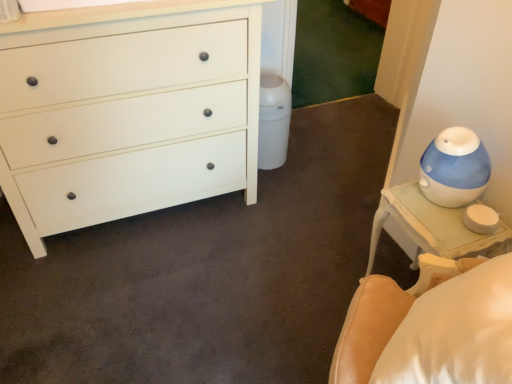
Question: Does white matte chest of drawers at left have a lesser width compared to white glossy nightstand at right?

Choices:
 (A) yes
 (B) no

Answer: (B)

Question: Does white matte chest of drawers at left lie in front of white glossy nightstand at right?

Choices:
 (A) no
 (B) yes

Answer: (B)

Question: Is white matte chest of drawers at left taller than white glossy nightstand at right?

Choices:
 (A) no
 (B) yes

Answer: (B)

Question: From the image's perspective, would you say white matte chest of drawers at left is positioned over white glossy nightstand at right?

Choices:
 (A) no
 (B) yes

Answer: (B)

Question: Considering the relative sizes of white matte chest of drawers at left and white glossy nightstand at right in the image provided, is white matte chest of drawers at left wider than white glossy nightstand at right?

Choices:
 (A) yes
 (B) no

Answer: (A)

Question: Would you say white glossy nightstand at right is part of white matte chest of drawers at left's contents?

Choices:
 (A) yes
 (B) no

Answer: (B)

Question: Is white glossy nightstand at right turned away from white matte chest of drawers at left?

Choices:
 (A) no
 (B) yes

Answer: (A)

Question: Is white glossy nightstand at right not within white matte chest of drawers at left?

Choices:
 (A) no
 (B) yes

Answer: (B)

Question: Is white glossy nightstand at right smaller than white matte chest of drawers at left?

Choices:
 (A) no
 (B) yes

Answer: (B)

Question: Is white glossy nightstand at right bigger than white matte chest of drawers at left?

Choices:
 (A) no
 (B) yes

Answer: (A)

Question: From the image's perspective, is white glossy nightstand at right on white matte chest of drawers at left?

Choices:
 (A) no
 (B) yes

Answer: (A)

Question: Is white glossy nightstand at right taller than white matte chest of drawers at left?

Choices:
 (A) yes
 (B) no

Answer: (B)

Question: From their relative heights in the image, would you say white glossy nightstand at right is taller or shorter than white matte chest of drawers at left?

Choices:
 (A) tall
 (B) short

Answer: (B)